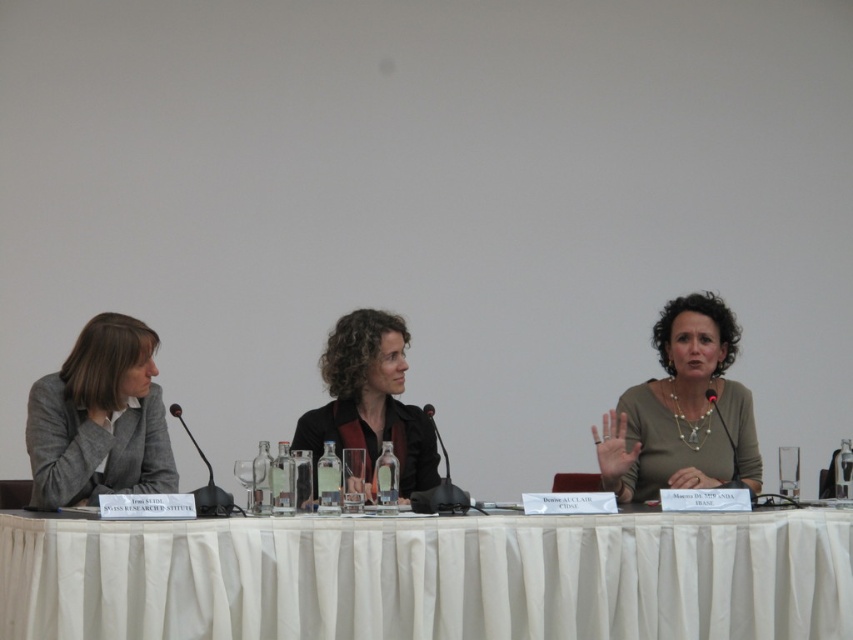
Between white cloth at center and matte beige blouse at center, which one is positioned lower?

white cloth at center

Can you confirm if white cloth at center is positioned to the right of matte beige blouse at center?

Incorrect, white cloth at center is not on the right side of matte beige blouse at center.

The image size is (853, 640). What do you see at coordinates (430, 577) in the screenshot?
I see `white cloth at center` at bounding box center [430, 577].

I want to click on white cloth at center, so click(430, 577).

Locate an element on the screen. The width and height of the screenshot is (853, 640). matte beige blouse at center is located at coordinates (682, 410).

Who is shorter, matte beige blouse at center or matte black jacket at center?

With less height is matte black jacket at center.

Who is more distant from viewer, (x=726, y=360) or (x=341, y=317)?

The point (x=726, y=360) is behind.

The image size is (853, 640). In order to click on matte beige blouse at center in this screenshot , I will do `click(682, 410)`.

Is white cloth at center wider than black plastic microphone at center?

Indeed, white cloth at center has a greater width compared to black plastic microphone at center.

Can you confirm if white cloth at center is positioned above black plastic microphone at center?

No.

Where is `white cloth at center`? white cloth at center is located at coordinates (430, 577).